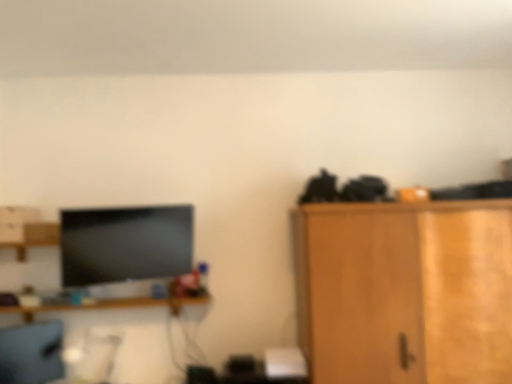
The width and height of the screenshot is (512, 384). Describe the element at coordinates (108, 305) in the screenshot. I see `wooden shelf at center` at that location.

Image resolution: width=512 pixels, height=384 pixels. In order to click on wooden cabinet at right in this screenshot , I will do `click(405, 291)`.

Based on their sizes in the image, would you say wooden shelf at center is bigger or smaller than matte gray computer chair at lower left?

In the image, wooden shelf at center appears to be larger than matte gray computer chair at lower left.

Is point (112, 305) closer to viewer compared to point (7, 355)?

No, (112, 305) is further to viewer.

From a real-world perspective, is wooden shelf at center positioned above or below matte gray computer chair at lower left?

From a real-world perspective, wooden shelf at center is physically above matte gray computer chair at lower left.

Based on the photo, from the image's perspective, which is below, wooden shelf at center or matte gray computer chair at lower left?

matte gray computer chair at lower left appears lower in the image.

Between matte gray computer chair at lower left and wooden cabinet at right, which one appears on the right side from the viewer's perspective?

Positioned to the right is wooden cabinet at right.

Is the position of matte gray computer chair at lower left less distant than that of wooden cabinet at right?

No, it is behind wooden cabinet at right.

Between matte gray computer chair at lower left and wooden cabinet at right, which one has larger width?

wooden cabinet at right.

Considering the sizes of matte gray computer chair at lower left and wooden cabinet at right in the image, is matte gray computer chair at lower left bigger or smaller than wooden cabinet at right?

Considering their sizes, matte gray computer chair at lower left takes up less space than wooden cabinet at right.

Is wooden shelf at center looking in the opposite direction of wooden cabinet at right?

wooden shelf at center does not have its back to wooden cabinet at right.

From the image's perspective, is wooden shelf at center over wooden cabinet at right?

Actually, wooden shelf at center appears below wooden cabinet at right in the image.

Which object is wider, wooden shelf at center or wooden cabinet at right?

wooden cabinet at right.

Where is `shelf to the left of wooden cabinet at right`? The width and height of the screenshot is (512, 384). shelf to the left of wooden cabinet at right is located at coordinates (108, 305).

Considering the relative sizes of wooden cabinet at right and matte gray computer chair at lower left in the image provided, is wooden cabinet at right thinner than matte gray computer chair at lower left?

No, wooden cabinet at right is not thinner than matte gray computer chair at lower left.

Is wooden cabinet at right far from matte gray computer chair at lower left?

That's right, there is a large distance between wooden cabinet at right and matte gray computer chair at lower left.

Which object is closer to the camera taking this photo, wooden cabinet at right or matte gray computer chair at lower left?

wooden cabinet at right is in front.

Does wooden cabinet at right have a greater height compared to matte gray computer chair at lower left?

Yes.

Which is in front, point (29, 337) or point (127, 304)?

The point (127, 304) is in front.

Locate an element on the screen. shelf that is above the matte gray computer chair at lower left (from the image's perspective) is located at coordinates (108, 305).

From a real-world perspective, is matte gray computer chair at lower left located higher than wooden shelf at center?

No, from a real-world perspective, matte gray computer chair at lower left is not over wooden shelf at center

Who is smaller, wooden cabinet at right or wooden shelf at center?

wooden shelf at center.

How different are the orientations of wooden cabinet at right and wooden shelf at center in degrees?

The angular difference between wooden cabinet at right and wooden shelf at center is 0.0176 degrees.

Choose the correct answer: Is wooden cabinet at right inside wooden shelf at center or outside it?

wooden cabinet at right is not inside wooden shelf at center, it's outside.

Looking at this image, from the image's perspective, which is below, wooden cabinet at right or wooden shelf at center?

wooden shelf at center, from the image's perspective.

Where is `computer chair on the left of the wooden shelf at center`? computer chair on the left of the wooden shelf at center is located at coordinates (31, 353).

Where is `computer chair that is under the wooden cabinet at right (from a real-world perspective)`? Image resolution: width=512 pixels, height=384 pixels. computer chair that is under the wooden cabinet at right (from a real-world perspective) is located at coordinates (31, 353).

Which object lies further to the anchor point matte gray computer chair at lower left, wooden cabinet at right or wooden shelf at center?

The object further to matte gray computer chair at lower left is wooden cabinet at right.

Looking at the image, which one is located closer to matte gray computer chair at lower left, wooden shelf at center or wooden cabinet at right?

wooden shelf at center.

Estimate the real-world distances between objects in this image. Which object is further from wooden cabinet at right, matte gray computer chair at lower left or wooden shelf at center?

matte gray computer chair at lower left is positioned further to the anchor wooden cabinet at right.

Based on their spatial positions, is matte gray computer chair at lower left or wooden cabinet at right closer to wooden shelf at center?

matte gray computer chair at lower left lies closer to wooden shelf at center than the other object.

Based on the photo, based on their spatial positions, is wooden shelf at center or matte gray computer chair at lower left closer to wooden cabinet at right?

wooden shelf at center.

Which object lies further to the anchor point wooden shelf at center, wooden cabinet at right or matte gray computer chair at lower left?

The object further to wooden shelf at center is wooden cabinet at right.

Find the location of a particular element. This screenshot has width=512, height=384. shelf between matte gray computer chair at lower left and wooden cabinet at right from left to right is located at coordinates (108, 305).